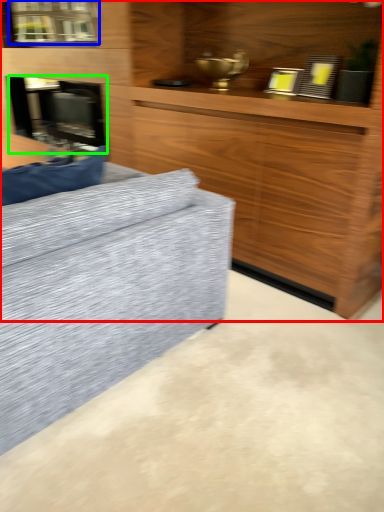
Question: Based on their relative distances, which object is farther from cabinetry (highlighted by a red box)? Choose from window (highlighted by a blue box) and fireplace (highlighted by a green box).

Choices:
 (A) window
 (B) fireplace

Answer: (A)